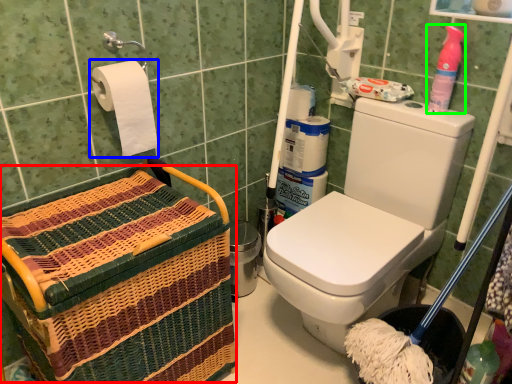
Question: Which object is the closest to the basket (highlighted by a red box)? Choose among these: toilet paper (highlighted by a blue box) or cleaning product (highlighted by a green box).

Choices:
 (A) toilet paper
 (B) cleaning product

Answer: (A)